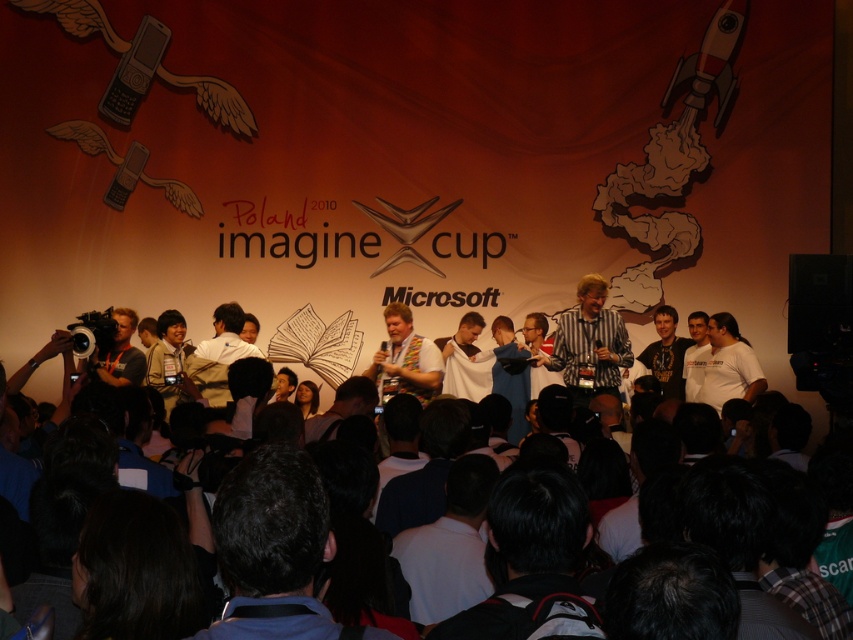
Question: Can you confirm if dark blue fabric at center is bigger than dark gray t-shirt at center?

Choices:
 (A) yes
 (B) no

Answer: (A)

Question: Is dark gray t-shirt at center to the left of light brown shirt at center from the viewer's perspective?

Choices:
 (A) yes
 (B) no

Answer: (B)

Question: Which point appears farthest from the camera in this image?

Choices:
 (A) (287, 552)
 (B) (599, 321)

Answer: (B)

Question: Among these objects, which one is farthest from the camera?

Choices:
 (A) dark blue fabric at center
 (B) khaki uniform at center
 (C) striped shirt at center

Answer: (C)

Question: Is dark blue fabric at center positioned before dark gray t-shirt at center?

Choices:
 (A) no
 (B) yes

Answer: (B)

Question: Among these points, which one is nearest to the camera?

Choices:
 (A) (300, 472)
 (B) (659, 321)

Answer: (A)